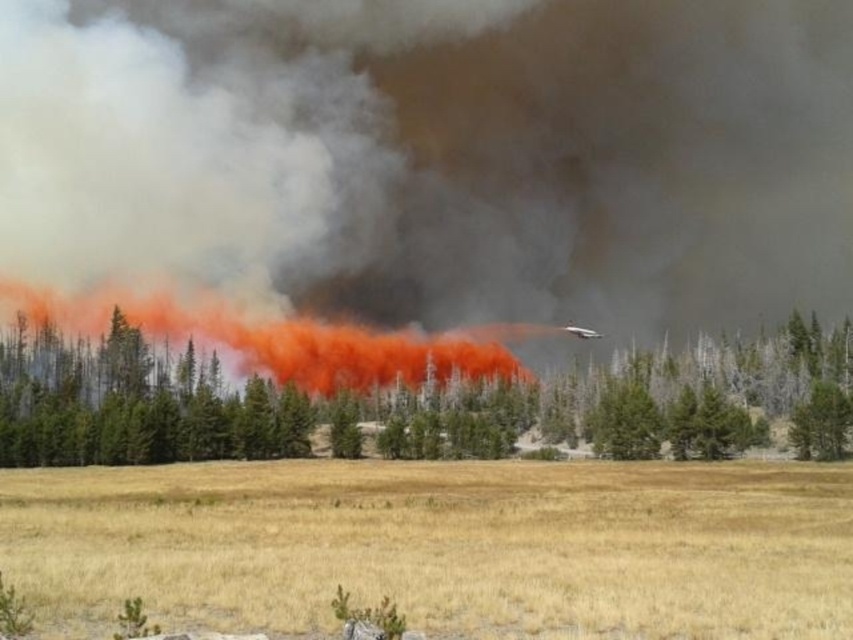
Question: Based on their relative distances, which object is nearer to the green matte tree at center?

Choices:
 (A) orange smoke at center
 (B) dry grass at lower center

Answer: (A)

Question: Can you confirm if dry grass at lower center is positioned above green matte tree at center?

Choices:
 (A) yes
 (B) no

Answer: (B)

Question: Is green matte tree at center above orange smoke at center?

Choices:
 (A) no
 (B) yes

Answer: (A)

Question: Is dry grass at lower center to the right of orange smoke at center from the viewer's perspective?

Choices:
 (A) yes
 (B) no

Answer: (A)

Question: Estimate the real-world distances between objects in this image. Which object is farther from the green matte tree at center?

Choices:
 (A) dry grass at lower center
 (B) orange smoke at center

Answer: (A)

Question: Estimate the real-world distances between objects in this image. Which object is closer to the green matte tree at center?

Choices:
 (A) orange smoke at center
 (B) dry grass at lower center

Answer: (A)